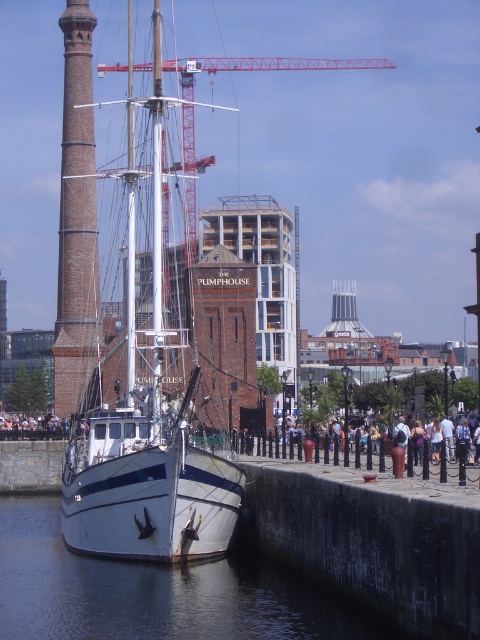
Who is lower down, brick tower at left or brick tower at center?

brick tower at center is lower down.

Is point (68, 225) closer to camera compared to point (257, 282)?

Yes, it is in front of point (257, 282).

The width and height of the screenshot is (480, 640). Find the location of `brick tower at left`. brick tower at left is located at coordinates (76, 220).

Who is more forward, (176, 513) or (232, 252)?

Point (176, 513) is more forward.

Is white matte sailboat at center in front of brick tower at center?

Yes, it is.

Is point (155, 225) more distant than point (233, 209)?

No, it is in front of (233, 209).

Locate an element on the screen. Image resolution: width=480 pixels, height=640 pixels. white matte sailboat at center is located at coordinates (146, 426).

Which is more to the left, white matte sailboat at center or clear water at boat front?

Positioned to the left is white matte sailboat at center.

Does white matte sailboat at center have a greater height compared to clear water at boat front?

Yes.

Describe the element at coordinates (146, 426) in the screenshot. The height and width of the screenshot is (640, 480). I see `white matte sailboat at center` at that location.

This screenshot has height=640, width=480. Identify the location of white matte sailboat at center. (146, 426).